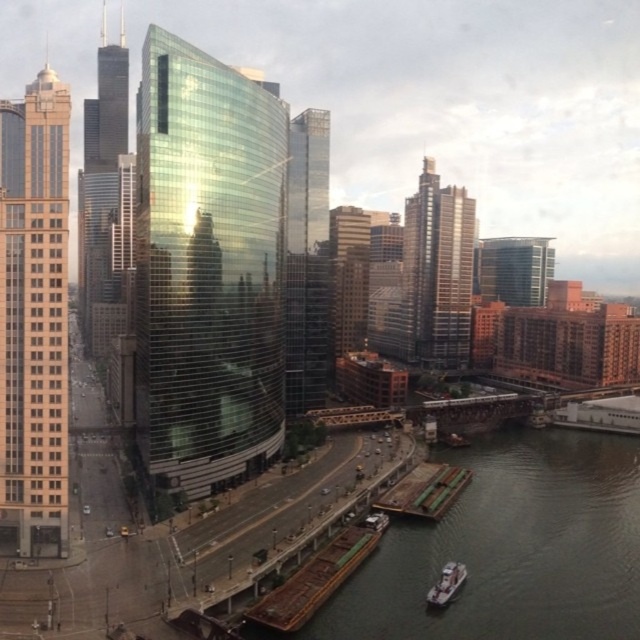
You are a drone operator tasked with capturing aerial footage of the shiny glass skyscraper at center. Your drone is currently at coordinates point A, which is at the edge of the river. To reach the skyscraper, you need to fly in a straight line. What direction should you set your drone to fly from point A to reach the skyscraper?

The shiny glass skyscraper at center is located at point coordinates point A is at the edge of the river. To fly in a straight line from point A to the skyscraper, you would need to fly northeast, as the skyscraper is positioned northeast of point A based on its coordinates.

Based on the photo, you are a city planner analyzing this urban landscape. You need to place a new public bench near the green metallic river at lower center. According to the coordinates provided, where should you place the bench relative to the river?

The green metallic river at lower center is located at coordinates point (509,548), so the bench should be placed near that position.

You are a tourist standing on the riverbank and want to take a photo of the green metallic river at lower center and the brown wooden dock at lower right. Which object should you focus on first to ensure both are in the frame?

You should focus on the brown wooden dock at lower right first because it is farther away from you than the green metallic river at lower center, allowing you to frame both objects properly.